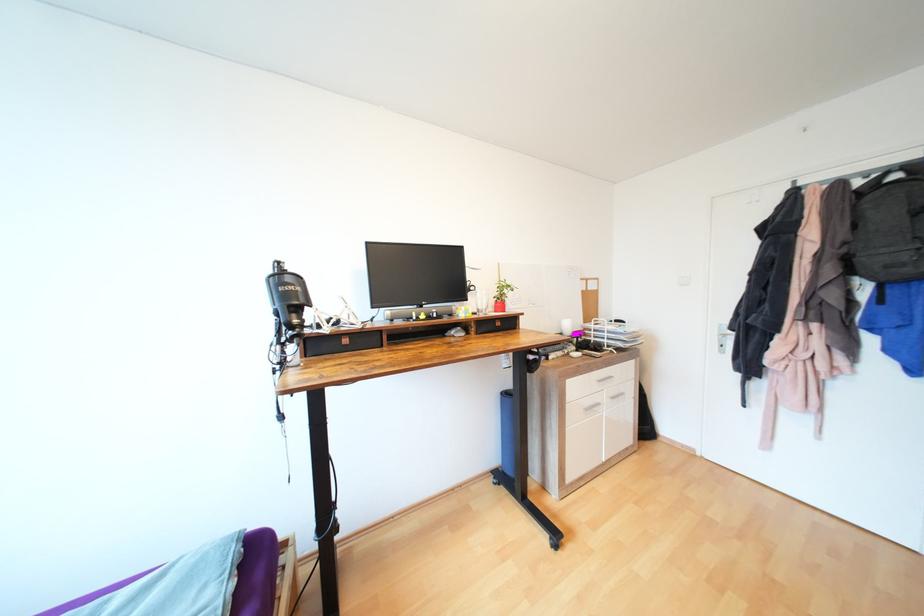
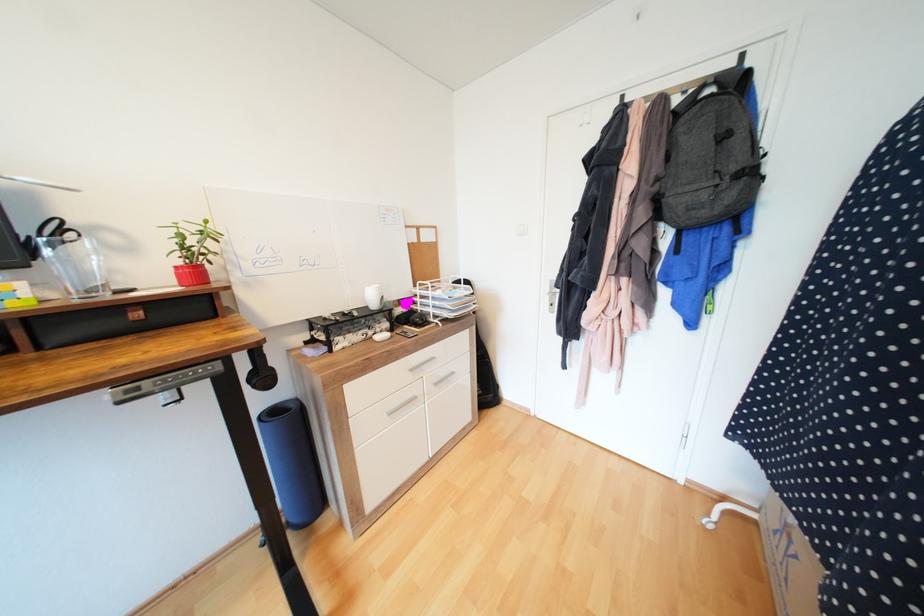
The images are taken continuously from a first-person perspective. In which direction are you moving?

The movement direction of the cameraman is right, forward.